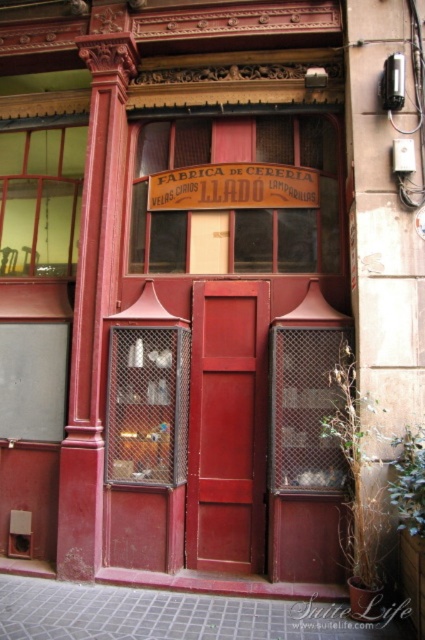
How distant is matte wood door at center from brown wood sign at center?

They are 4.52 feet apart.

Measure the distance between matte wood door at center and camera.

matte wood door at center is 4.58 meters away from camera.

This screenshot has width=425, height=640. What are the coordinates of `matte wood door at center` in the screenshot? It's located at (227, 426).